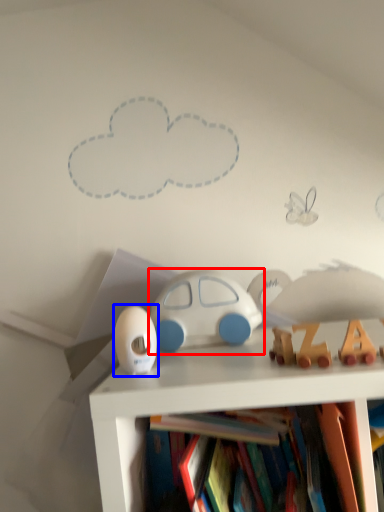
Question: Which object is closer to the camera taking this photo, toy (highlighted by a red box) or toy (highlighted by a blue box)?

Choices:
 (A) toy
 (B) toy

Answer: (B)